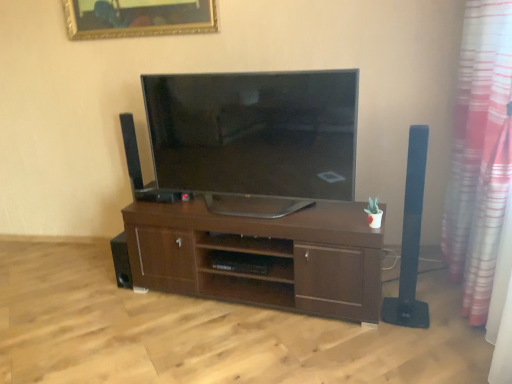
Where is `vacant space underneath black matte speaker at right, which is the first speaker in front-to-back order (from a real-world perspective)`? The width and height of the screenshot is (512, 384). vacant space underneath black matte speaker at right, which is the first speaker in front-to-back order (from a real-world perspective) is located at coordinates (403, 311).